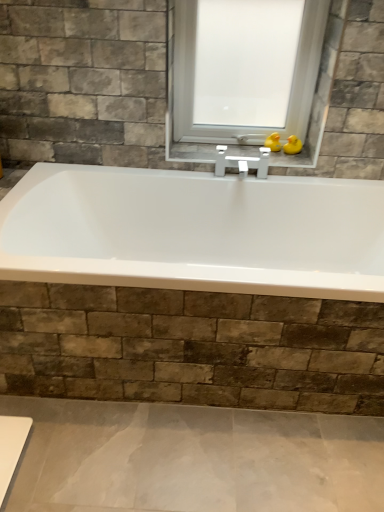
Question: Should I look upward or downward to see yellow rubber duck at upper center, marked as the 2th duck in a right-to-left arrangement?

Choices:
 (A) down
 (B) up

Answer: (B)

Question: Does transparent glass window at center appear on the left side of yellow rubber duck at upper right, the 1th duck when ordered from right to left?

Choices:
 (A) yes
 (B) no

Answer: (A)

Question: Is transparent glass window at center at the right side of yellow rubber duck at upper right, the 2th duck in the left-to-right sequence?

Choices:
 (A) yes
 (B) no

Answer: (B)

Question: From the image's perspective, is transparent glass window at center above yellow rubber duck at upper right, the 2th duck in the left-to-right sequence?

Choices:
 (A) no
 (B) yes

Answer: (B)

Question: Can you confirm if transparent glass window at center is wider than yellow rubber duck at upper right, the 1th duck when ordered from right to left?

Choices:
 (A) no
 (B) yes

Answer: (B)

Question: Does transparent glass window at center turn towards yellow rubber duck at upper right, the 2th duck in the left-to-right sequence?

Choices:
 (A) yes
 (B) no

Answer: (A)

Question: Is transparent glass window at center positioned beyond the bounds of yellow rubber duck at upper right, the 1th duck when ordered from right to left?

Choices:
 (A) no
 (B) yes

Answer: (B)

Question: Can you confirm if transparent glass window at center is bigger than yellow rubber duck at upper center, marked as the 2th duck in a right-to-left arrangement?

Choices:
 (A) no
 (B) yes

Answer: (B)

Question: Is transparent glass window at center not inside yellow rubber duck at upper center, the 1th duck viewed from the left?

Choices:
 (A) yes
 (B) no

Answer: (A)

Question: Considering the relative sizes of transparent glass window at center and yellow rubber duck at upper center, the 1th duck viewed from the left, in the image provided, is transparent glass window at center wider than yellow rubber duck at upper center, the 1th duck viewed from the left,?

Choices:
 (A) yes
 (B) no

Answer: (A)

Question: From a real-world perspective, is transparent glass window at center under yellow rubber duck at upper center, the 1th duck viewed from the left?

Choices:
 (A) no
 (B) yes

Answer: (A)

Question: Is transparent glass window at center smaller than yellow rubber duck at upper center, the 1th duck viewed from the left?

Choices:
 (A) no
 (B) yes

Answer: (A)

Question: From the image's perspective, is transparent glass window at center on top of yellow rubber duck at upper center, the 1th duck viewed from the left?

Choices:
 (A) no
 (B) yes

Answer: (B)

Question: Does yellow rubber duck at upper right, the 2th duck in the left-to-right sequence, have a smaller size compared to yellow rubber duck at upper center, the 1th duck viewed from the left?

Choices:
 (A) yes
 (B) no

Answer: (B)